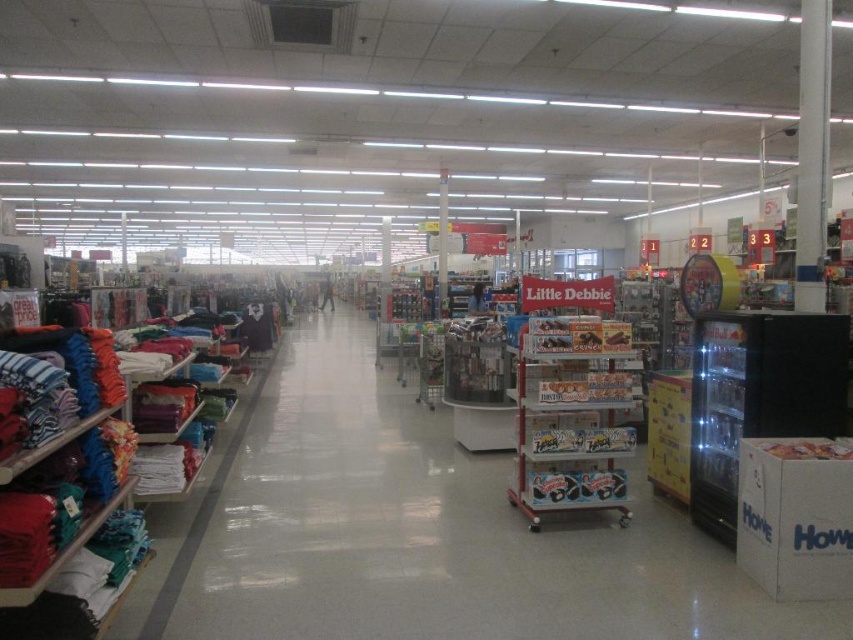
Question: Which object appears closest to the camera in this image?

Choices:
 (A) blue cotton t-shirt at center
 (B) dark blue jersey at center

Answer: (B)

Question: Does white plastic shelves at center have a greater width compared to matte blue jeans at center?

Choices:
 (A) yes
 (B) no

Answer: (A)

Question: Estimate the real-world distances between objects in this image. Which object is farther from the matte blue jeans at center?

Choices:
 (A) white plastic shelves at center
 (B) dark blue jersey at center

Answer: (A)

Question: Is dark blue jersey at center bigger than matte blue jeans at center?

Choices:
 (A) no
 (B) yes

Answer: (B)

Question: Is matte blue jeans at center wider than blue cotton t-shirt at center?

Choices:
 (A) yes
 (B) no

Answer: (A)

Question: Estimate the real-world distances between objects in this image. Which object is farther from the white plastic shelves at center?

Choices:
 (A) matte blue jeans at center
 (B) blue cotton t-shirt at center

Answer: (B)